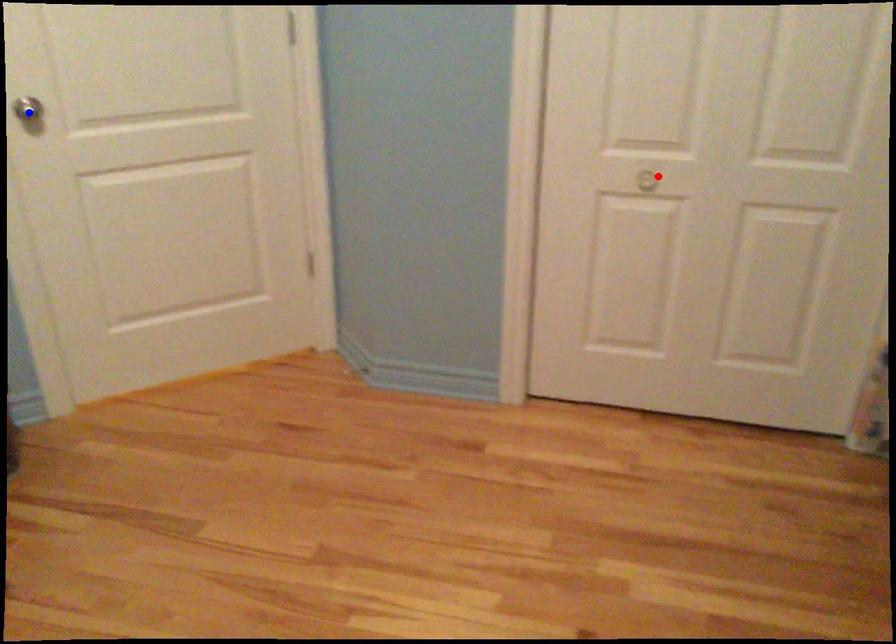
Question: Two points are marked on the image. Which point is closer to the camera?

Choices:
 (A) Blue point is closer.
 (B) Red point is closer.

Answer: (A)